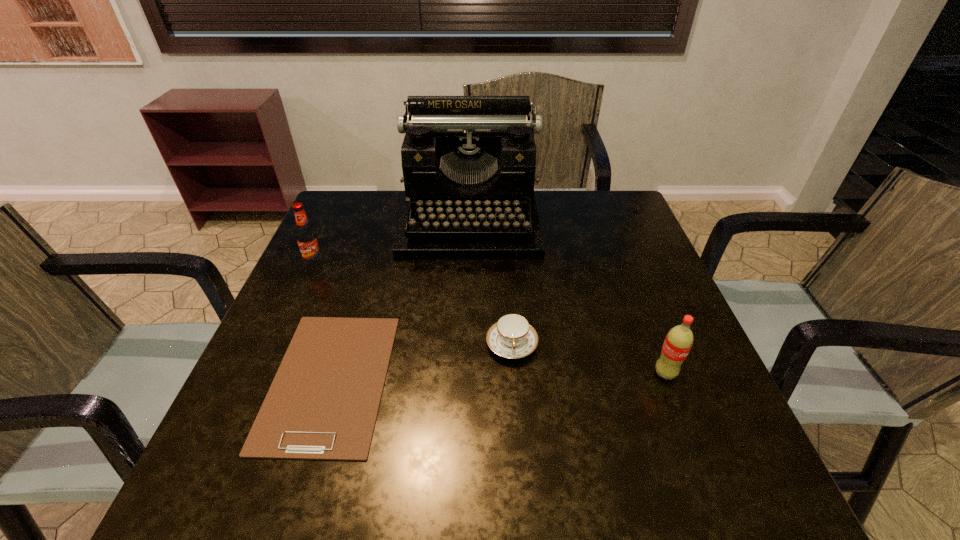
Locate an element on the screen. The width and height of the screenshot is (960, 540). empty space between the teacup and the typewriter is located at coordinates click(x=491, y=282).

Where is `blank region between the fourth nearest object and the tallest object`? Image resolution: width=960 pixels, height=540 pixels. blank region between the fourth nearest object and the tallest object is located at coordinates (393, 243).

This screenshot has width=960, height=540. Find the location of `free point between the soda and the root beer`. free point between the soda and the root beer is located at coordinates (491, 319).

At what (x,y) coordinates should I click in order to perform the action: click on object that can be found as the second closest to the clipboard. Please return your answer as a coordinate pair (x, y). The width and height of the screenshot is (960, 540). Looking at the image, I should click on (512, 336).

The image size is (960, 540). In order to click on the fourth closest object to the tallest object in this screenshot , I will do `click(679, 340)`.

Where is `vacant area in the image that satisfies the following two spatial constraints: 1. on the typing side of the farthest object; 2. on the left side of the rightmost object`? vacant area in the image that satisfies the following two spatial constraints: 1. on the typing side of the farthest object; 2. on the left side of the rightmost object is located at coordinates (466, 374).

Identify the location of vacant space that satisfies the following two spatial constraints: 1. on the side with the handle of the soda; 2. on the right side of the second shortest object. (514, 374).